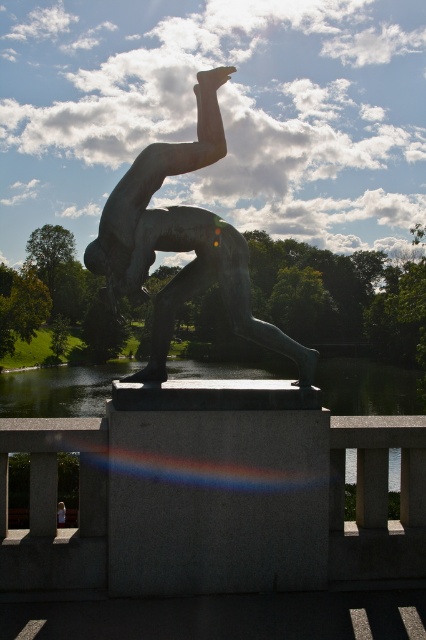
You are standing at the center of a bridge and see the bronze statue at center. If you walk straight ahead, will you reach the statue before the end of the bridge?

Yes, because the bronze statue at center is located at point (x=181, y=243), which is closer to your current position than the end of the bridge.

You are standing on the bridge where the bronze sculpture is placed. There are two points marked on the pedestal. One is at point (x=175, y=300) and the other at point (x=348, y=358). Which point is closer to you?

Point (x=175, y=300) is in front of point (x=348, y=358), so it is closer to you.

You are a delivery drone carrying a package that needs to pass between the bronze statue at center and the transparent glass water at center. The package is 1.2 meters wide. Can the package fit through the space between them?

The bronze statue at center is narrower than the transparent glass water at center, but the exact width difference isn not specified. However, since the package is 1.2 meters wide, we need to know the minimum width between them. Without specific measurements, it is impossible to determine if the package will fit.